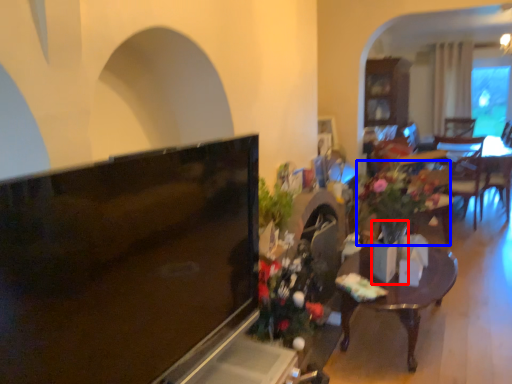
Question: Which point is closer to the camera, vase (highlighted by a red box) or houseplant (highlighted by a blue box)?

Choices:
 (A) vase
 (B) houseplant

Answer: (A)